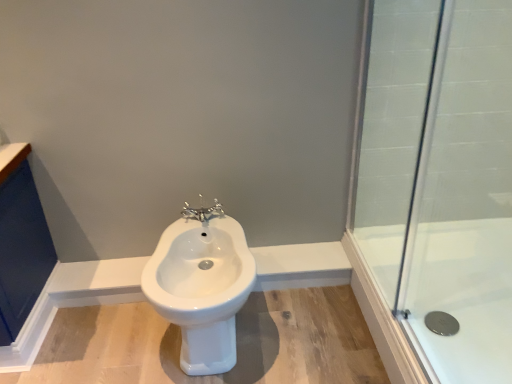
What are the coordinates of `spots to the right of white glossy bidet at center` in the screenshot? It's located at (308, 331).